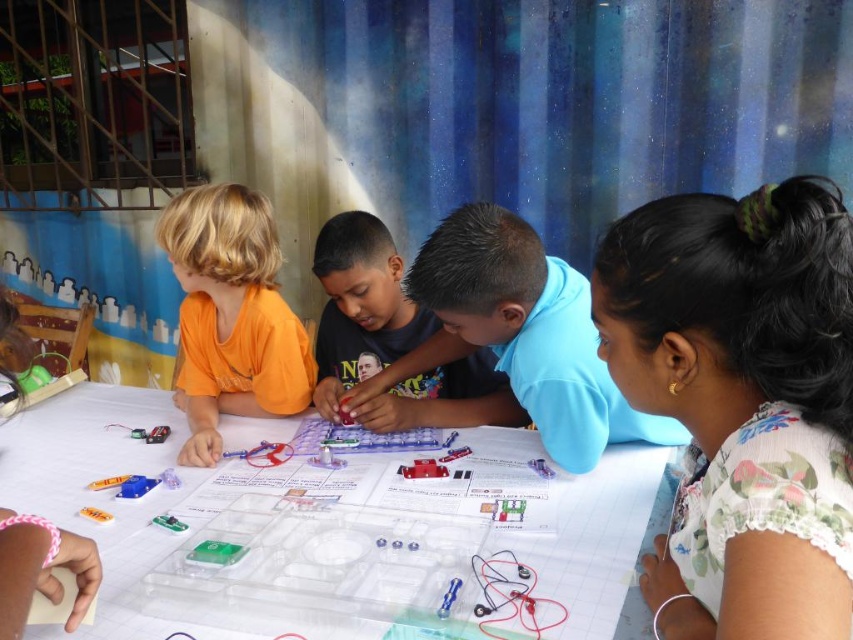
Question: Which point is farther to the camera?

Choices:
 (A) (187, 516)
 (B) (287, 380)
 (C) (339, 304)

Answer: (C)

Question: Which of the following is the farthest from the observer?

Choices:
 (A) orange matte shirt at left
 (B) blue matte shirt at center
 (C) clear plastic table at center

Answer: (B)

Question: Does orange matte shirt at left come in front of blue matte shirt at center?

Choices:
 (A) yes
 (B) no

Answer: (A)

Question: Can you confirm if clear plastic table at center is bigger than orange matte shirt at left?

Choices:
 (A) yes
 (B) no

Answer: (A)

Question: Which of the following is the closest to the observer?

Choices:
 (A) (558, 525)
 (B) (332, 280)
 (C) (251, 348)

Answer: (A)

Question: Can you confirm if orange matte shirt at left is positioned above blue matte shirt at center?

Choices:
 (A) yes
 (B) no

Answer: (A)